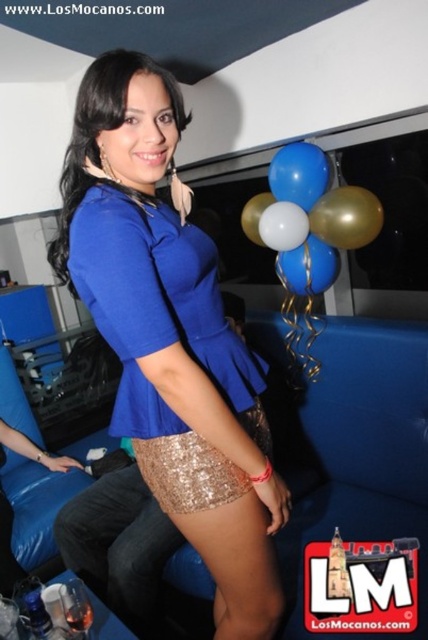
Question: Does sequin fabric skirt at lower center appear on the right side of blue glossy balloons at upper center?

Choices:
 (A) no
 (B) yes

Answer: (A)

Question: Can you confirm if gold sequined miniskirt at center is thinner than blue glossy balloon at upper right?

Choices:
 (A) yes
 (B) no

Answer: (B)

Question: Does blue sequined skirt at center appear on the left side of blue glossy balloon at upper right?

Choices:
 (A) no
 (B) yes

Answer: (B)

Question: Which object appears closest to the camera in this image?

Choices:
 (A) gold metallic balloon at upper center
 (B) sequin fabric skirt at lower center
 (C) blue glossy balloons at upper center
 (D) blue glossy balloon at upper right

Answer: (B)

Question: Which of the following is the closest to the observer?

Choices:
 (A) blue glossy balloons at upper center
 (B) gold sequined miniskirt at center

Answer: (B)

Question: Which object is positioned farthest from the blue glossy balloon at center?

Choices:
 (A) blue glossy balloons at upper center
 (B) white matte balloon at center

Answer: (A)